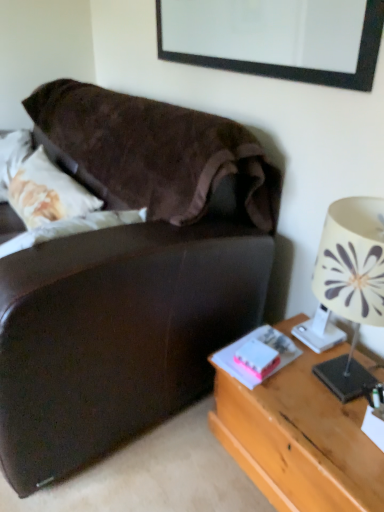
This screenshot has width=384, height=512. Find the location of `free space in front of pink matte book at lower right, which ranks as the first book in right-to-left order`. free space in front of pink matte book at lower right, which ranks as the first book in right-to-left order is located at coordinates (297, 399).